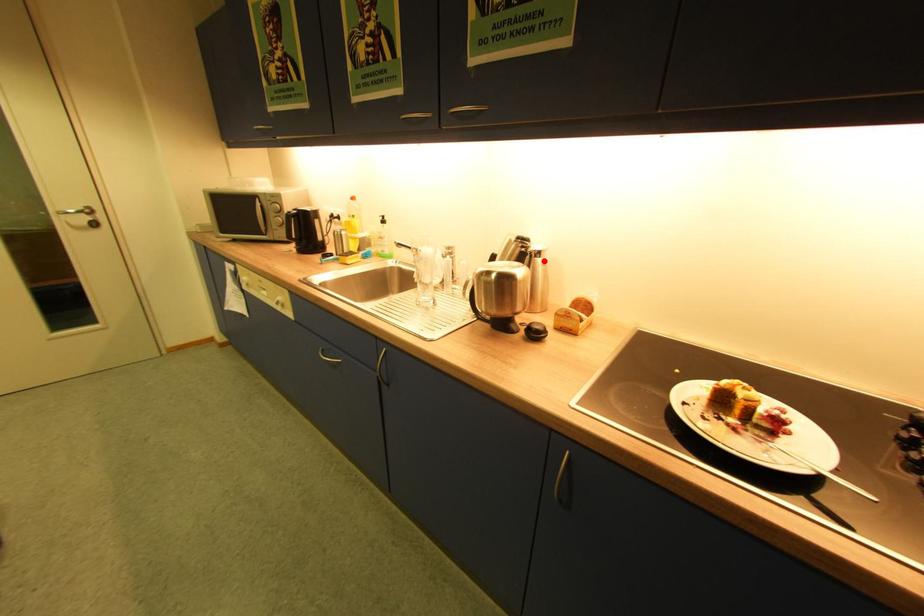
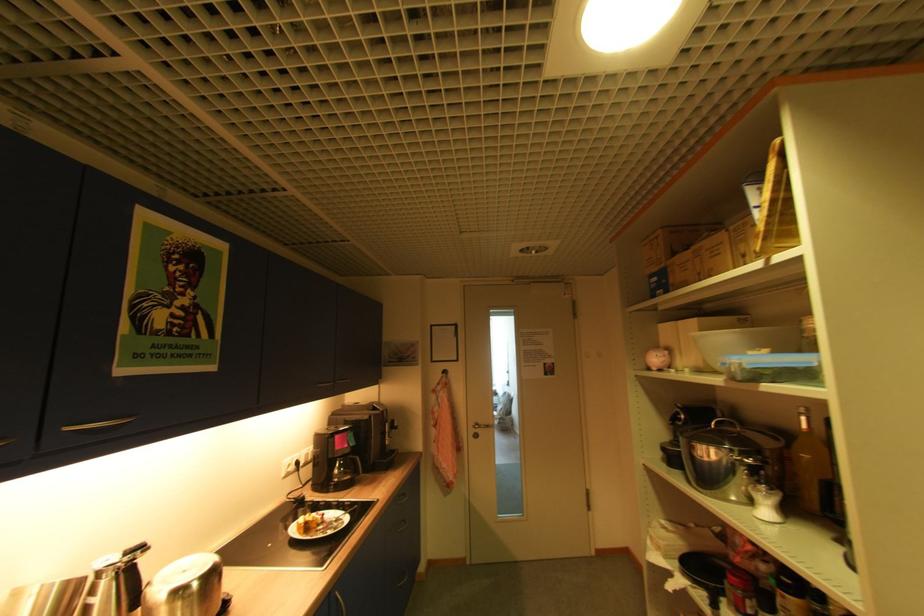
Locate, in the second image, the point that corresponds to the highlighted location in the first image.

(128, 572)